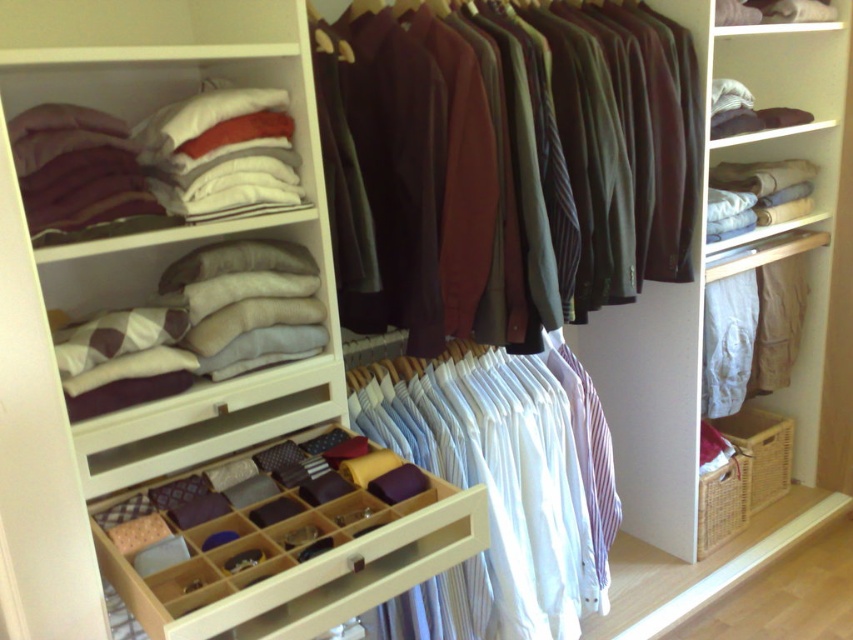
Is dark brown wool sweaters at center in front of white cotton shirts at center?

Yes.

In order to click on dark brown wool sweaters at center in this screenshot , I will do `click(517, 161)`.

Where is `dark brown wool sweaters at center`? dark brown wool sweaters at center is located at coordinates (517, 161).

Does wooden tie organizer at center appear over white cotton shirts at center?

Yes.

Is point (360, 570) in front of point (563, 611)?

That is True.

Image resolution: width=853 pixels, height=640 pixels. What are the coordinates of `wooden tie organizer at center` in the screenshot? It's located at (283, 544).

Between point (335, 131) and point (242, 598), which one is positioned behind?

The point (335, 131) is behind.

Is dark brown wool sweaters at center bigger than wooden tie organizer at center?

Indeed, dark brown wool sweaters at center has a larger size compared to wooden tie organizer at center.

Measure the distance between dark brown wool sweaters at center and camera.

dark brown wool sweaters at center is 4.95 feet away from camera.

Where is `dark brown wool sweaters at center`? Image resolution: width=853 pixels, height=640 pixels. dark brown wool sweaters at center is located at coordinates (517, 161).